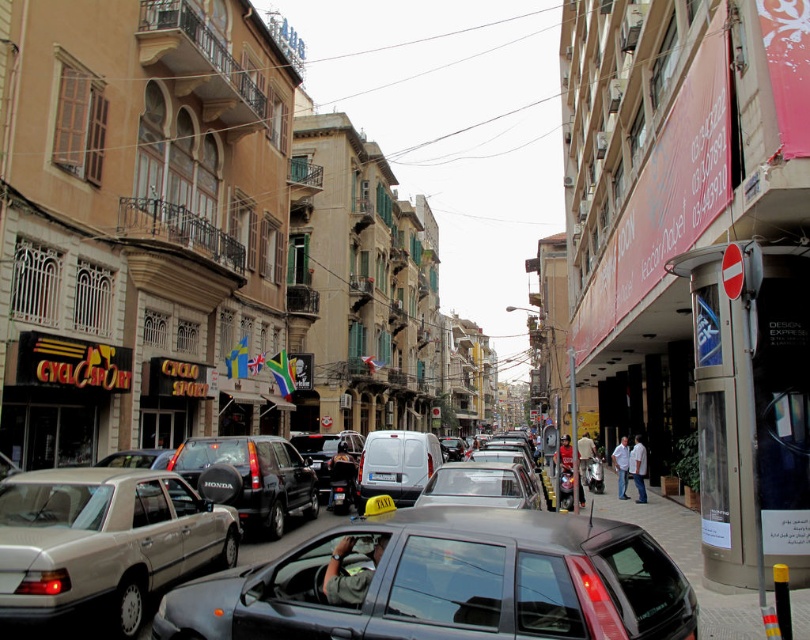
Question: Which object is the closest to the matte black suv at center?

Choices:
 (A) silver metallic sedan at center
 (B) black glossy car at center

Answer: (A)

Question: Is silver metallic sedan at center to the right of white plastic license plate at center from the viewer's perspective?

Choices:
 (A) no
 (B) yes

Answer: (A)

Question: Among these points, which one is farthest from the camera?

Choices:
 (A) (x=126, y=628)
 (B) (x=309, y=563)
 (C) (x=373, y=476)
 (D) (x=467, y=502)

Answer: (C)

Question: Which point appears closest to the camera in this image?

Choices:
 (A) (69, 554)
 (B) (214, 636)

Answer: (B)

Question: Can you confirm if black glossy car at center is positioned to the left of white plastic license plate at center?

Choices:
 (A) no
 (B) yes

Answer: (A)

Question: Can you confirm if black glossy car at center is positioned to the right of matte black suv at center?

Choices:
 (A) yes
 (B) no

Answer: (A)